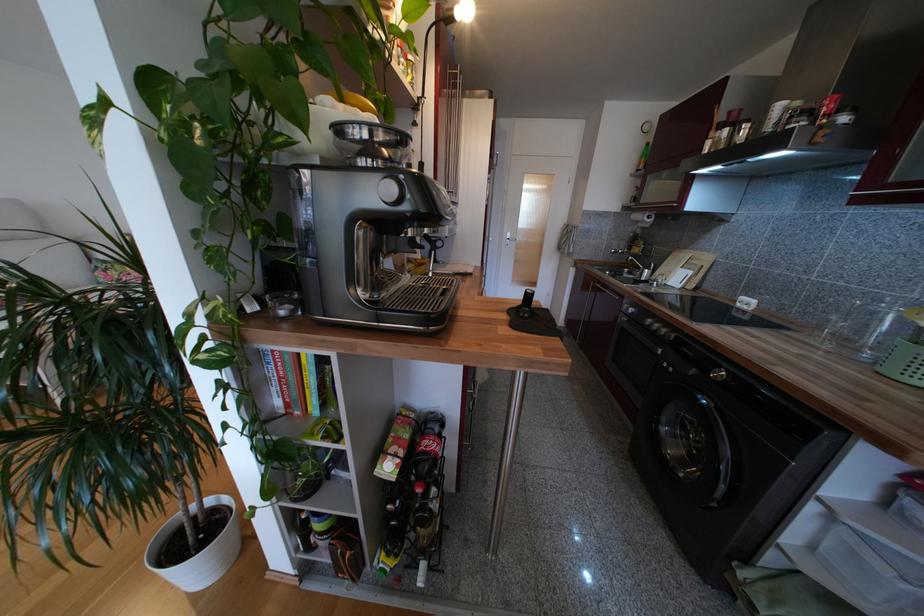
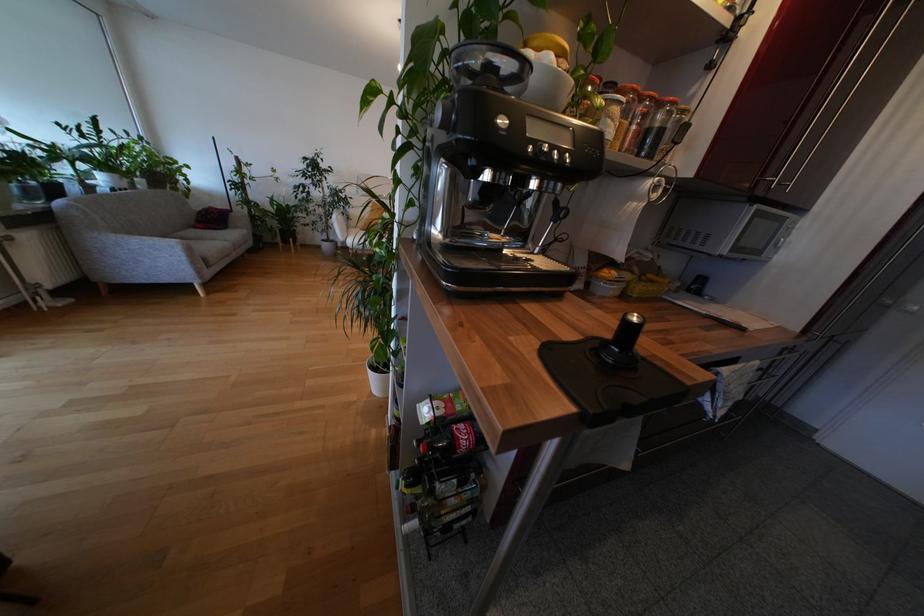
The point at (383, 462) is marked in the first image. Where is the corresponding point in the second image?

(431, 402)